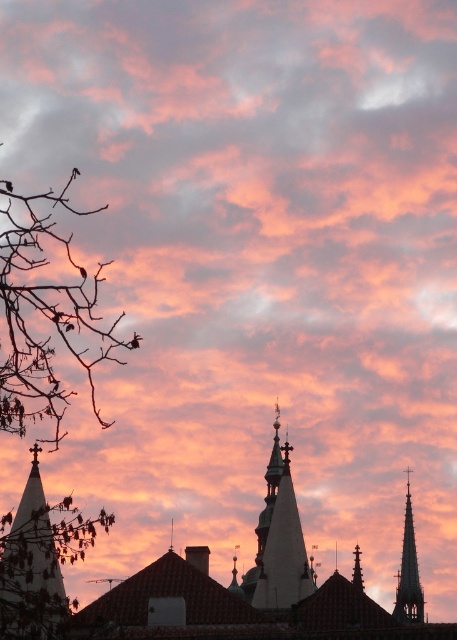
Which is in front, point (37, 474) or point (269, 477)?

Point (37, 474) is in front.

Who is taller, white steeple at left or white stone spire at center?

With more height is white stone spire at center.

Image resolution: width=457 pixels, height=640 pixels. In order to click on white steeple at left in this screenshot , I will do `click(31, 570)`.

In order to click on white steeple at left in this screenshot , I will do `click(31, 570)`.

From the picture: Does bare branches at left appear over smooth glass spire at upper right?

Indeed, bare branches at left is positioned over smooth glass spire at upper right.

Who is shorter, bare branches at left or smooth glass spire at upper right?

smooth glass spire at upper right is shorter.

Between point (48, 323) and point (405, 609), which one is positioned behind?

The point (405, 609) is more distant.

Where is `bare branches at left`? Image resolution: width=457 pixels, height=640 pixels. bare branches at left is located at coordinates (44, 314).

Is the position of white stone spire at center more distant than that of smooth gray spire at upper right?

No.

Does white stone spire at center appear on the right side of smooth gray spire at upper right?

No, white stone spire at center is not to the right of smooth gray spire at upper right.

I want to click on white stone spire at center, so click(279, 540).

This screenshot has height=640, width=457. Identify the location of white stone spire at center. (279, 540).